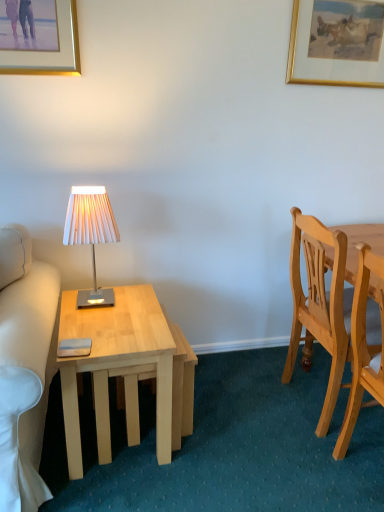
In order to click on space that is in front of white pleated fabric lampshade at left in this screenshot , I will do `click(100, 324)`.